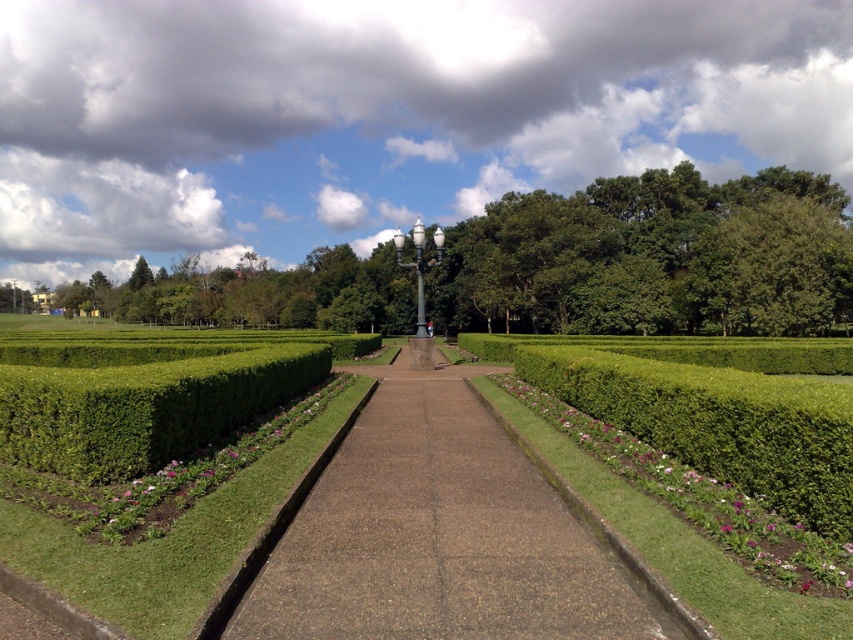
Question: Is brown concrete path at center thinner than green leafy tree at upper right?

Choices:
 (A) no
 (B) yes

Answer: (B)

Question: Considering the real-world distances, which object is farthest from the pink matte flower at lower left?

Choices:
 (A) purple matte flower at center-right
 (B) green leafy tree at upper right

Answer: (B)

Question: Which point is closer to the camera?

Choices:
 (A) (560, 424)
 (B) (114, 522)
 (C) (258, 390)

Answer: (B)

Question: Is green leafy tree at upper right bigger than purple matte flower at center-right?

Choices:
 (A) yes
 (B) no

Answer: (A)

Question: Which of the following is the farthest from the observer?

Choices:
 (A) pos(751,508)
 (B) pos(746,316)
 (C) pos(38,429)
 (D) pos(350,522)

Answer: (B)

Question: Is green leafy tree at upper right positioned in front of purple matte flower at center-right?

Choices:
 (A) no
 (B) yes

Answer: (A)